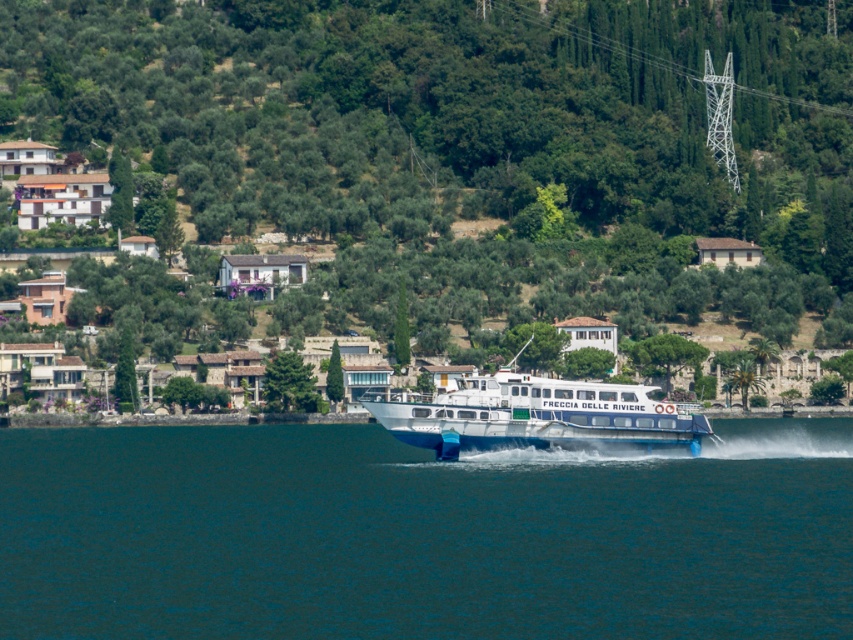
Does blue water at center have a larger size compared to white glossy hydrofoil boat at center?

Yes, blue water at center is bigger than white glossy hydrofoil boat at center.

Does blue water at center have a greater height compared to white glossy hydrofoil boat at center?

In fact, blue water at center may be shorter than white glossy hydrofoil boat at center.

Which is behind, point (741, 422) or point (393, 413)?

The point (741, 422) is more distant.

You are a GUI agent. You are given a task and a screenshot of the screen. Output one action in this format:
    pyautogui.click(x=<x>, y=<y>)
    Task: Click on the blue water at center
    The width and height of the screenshot is (853, 640).
    Given the screenshot: What is the action you would take?
    click(x=421, y=536)

Is point (688, 634) positioned after point (640, 58)?

No, it is in front of (640, 58).

Who is positioned more to the right, blue water at center or white metallic tower at upper center?

From the viewer's perspective, white metallic tower at upper center appears more on the right side.

Does point (393, 564) come farther from viewer compared to point (520, 4)?

That is False.

At what (x,y) coordinates should I click in order to perform the action: click on blue water at center. Please return your answer as a coordinate pair (x, y). Image resolution: width=853 pixels, height=640 pixels. Looking at the image, I should click on [x=421, y=536].

Does point (631, 408) come closer to viewer compared to point (793, 100)?

Yes.

Which is in front, point (577, 428) or point (651, 58)?

Point (577, 428)

What do you see at coordinates (540, 416) in the screenshot? This screenshot has width=853, height=640. I see `white glossy hydrofoil boat at center` at bounding box center [540, 416].

You are a GUI agent. You are given a task and a screenshot of the screen. Output one action in this format:
    pyautogui.click(x=<x>, y=<y>)
    Task: Click on the white glossy hydrofoil boat at center
    Image resolution: width=853 pixels, height=640 pixels.
    Given the screenshot: What is the action you would take?
    pyautogui.click(x=540, y=416)